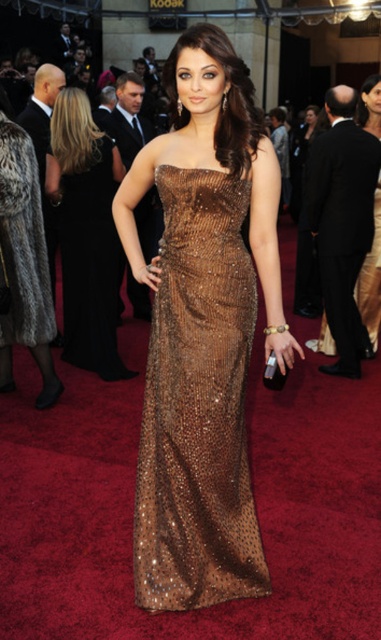
Question: Which point appears closest to the camera in this image?

Choices:
 (A) (14, 243)
 (B) (193, 468)

Answer: (B)

Question: Does shiny bronze gown at center lie in front of shiny bronze dress at center?

Choices:
 (A) yes
 (B) no

Answer: (A)

Question: Which of these objects is positioned farthest from the shiny bronze dress at center?

Choices:
 (A) shiny metallic dress at center
 (B) shiny bronze gown at center

Answer: (B)

Question: Which of the following is the closest to the observer?

Choices:
 (A) (331, 172)
 (B) (11, 138)
 (C) (65, 230)

Answer: (B)

Question: Does shiny bronze gown at center appear on the left side of shiny bronze dress at center?

Choices:
 (A) no
 (B) yes

Answer: (A)

Question: Where is shiny bronze dress at center located in relation to shiny black suit at center in the image?

Choices:
 (A) right
 (B) left

Answer: (B)